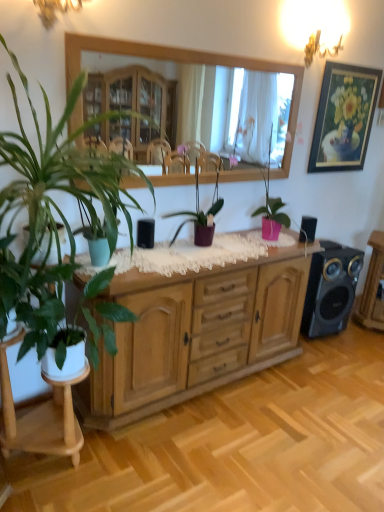
This screenshot has width=384, height=512. In order to click on blank space above wooden mirror at upper center (from a real-world perspective) in this screenshot , I will do `click(187, 45)`.